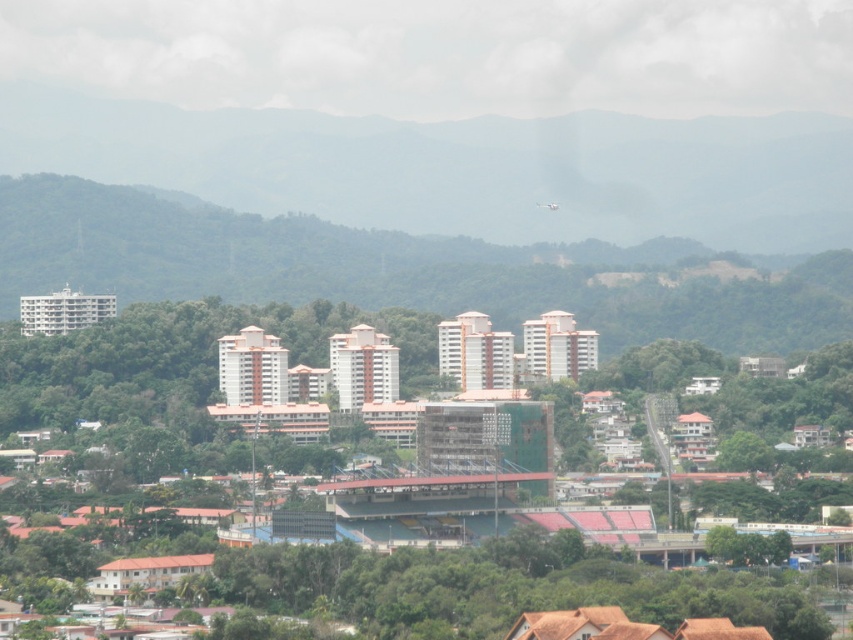
Which of these two, green leafy forest at center or green leafy tree at lower right, stands shorter?

green leafy tree at lower right

Does green leafy forest at center appear under green leafy tree at lower right?

Incorrect, green leafy forest at center is not positioned below green leafy tree at lower right.

Measure the distance between point (x=807, y=284) and camera.

Point (x=807, y=284) is 2191.36 feet from camera.

Where is `green leafy forest at center`? green leafy forest at center is located at coordinates (408, 269).

Can you confirm if green leafy forest at upper center is bigger than green leafy forest at center?

Yes, green leafy forest at upper center is bigger than green leafy forest at center.

Is point (616, 182) closer to viewer compared to point (502, 324)?

No, it is behind (502, 324).

What do you see at coordinates (463, 168) in the screenshot? I see `green leafy forest at upper center` at bounding box center [463, 168].

This screenshot has width=853, height=640. I want to click on green leafy forest at upper center, so tap(463, 168).

Does green leafy forest at center have a lesser width compared to white matte airplane at upper center?

No, green leafy forest at center is not thinner than white matte airplane at upper center.

Who is positioned more to the right, green leafy forest at center or white matte airplane at upper center?

Positioned to the right is white matte airplane at upper center.

Who is more forward, (76,179) or (554,204)?

Point (554,204)

This screenshot has width=853, height=640. In order to click on green leafy forest at center in this screenshot , I will do `click(408, 269)`.